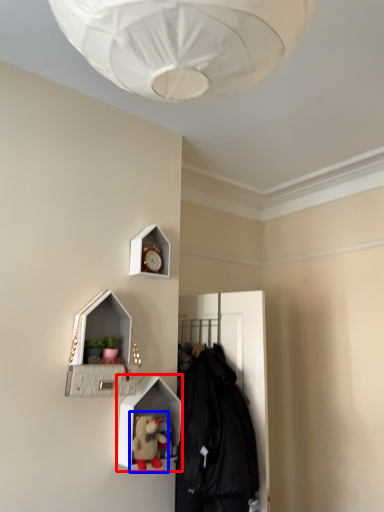
Question: Among these objects, which one is nearest to the camera, shelf (highlighted by a red box) or toy (highlighted by a blue box)?

Choices:
 (A) shelf
 (B) toy

Answer: (B)